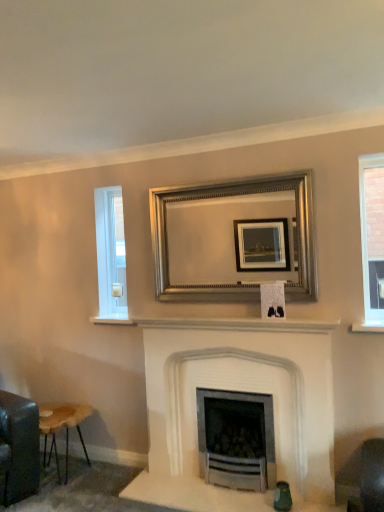
Question: Is white glass window at left, which is the 1th window in back-to-front order, taller or shorter than clear glass window at right, the second window when ordered from back to front?

Choices:
 (A) tall
 (B) short

Answer: (A)

Question: Considering the relative positions of white glass window at left, which is the second window in right-to-left order, and clear glass window at right, which is the second window in left-to-right order, in the image provided, is white glass window at left, which is the second window in right-to-left order, to the left or to the right of clear glass window at right, which is the second window in left-to-right order,?

Choices:
 (A) left
 (B) right

Answer: (A)

Question: Which of these objects is positioned closest to the wooden stool at lower left?

Choices:
 (A) clear glass window at right, which is the second window in left-to-right order
 (B) white stone fireplace at center
 (C) white glass window at left, which is the second window in right-to-left order
 (D) silver/golden metallic picture frame at center

Answer: (C)

Question: Estimate the real-world distances between objects in this image. Which object is closer to the white glass window at left, which is the second window in right-to-left order?

Choices:
 (A) silver/golden metallic picture frame at center
 (B) white stone fireplace at center
 (C) wooden stool at lower left
 (D) clear glass window at right, the second window when ordered from back to front

Answer: (A)